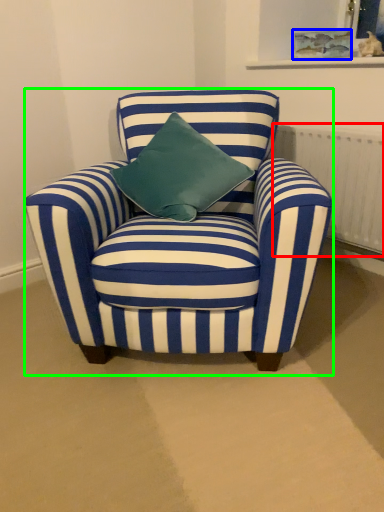
Question: Which is farther away from radiator (highlighted by a red box)? picture frame (highlighted by a blue box) or chair (highlighted by a green box)?

Choices:
 (A) picture frame
 (B) chair

Answer: (B)